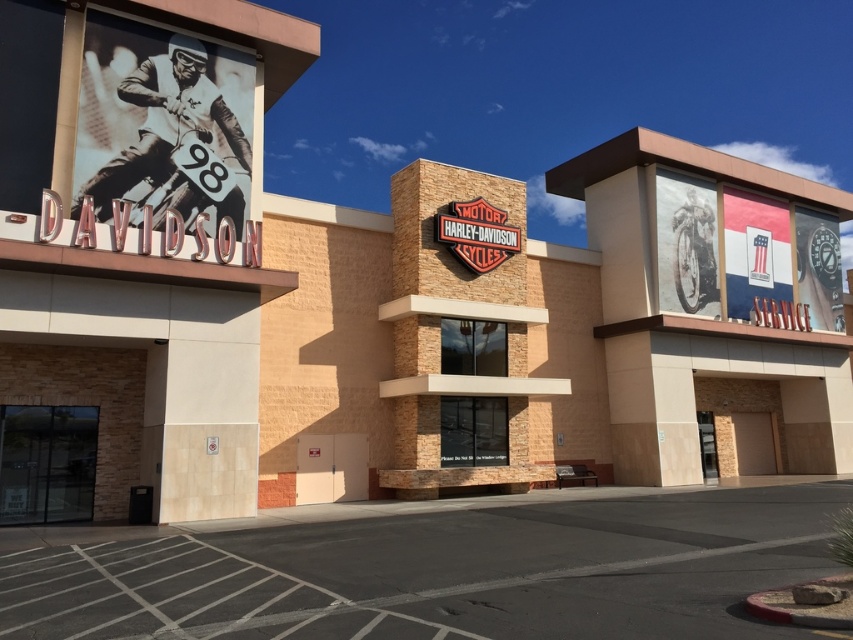
Question: Which object is closer to the camera taking this photo?

Choices:
 (A) transparent glass door at lower left
 (B) matte beige sign at upper left

Answer: (B)

Question: Which object is the closest to the matte beige sign at upper left?

Choices:
 (A) gray asphalt at lower center
 (B) transparent glass door at lower left

Answer: (B)

Question: Can you confirm if matte beige sign at upper left is smaller than gray asphalt at lower center?

Choices:
 (A) no
 (B) yes

Answer: (A)

Question: Is gray asphalt at lower center thinner than transparent glass door at lower left?

Choices:
 (A) yes
 (B) no

Answer: (B)

Question: Which is farther from the matte beige sign at upper left?

Choices:
 (A) gray asphalt at lower center
 (B) transparent glass door at lower left

Answer: (A)

Question: Where is matte beige sign at upper left located in relation to transparent glass door at lower left in the image?

Choices:
 (A) above
 (B) below

Answer: (A)